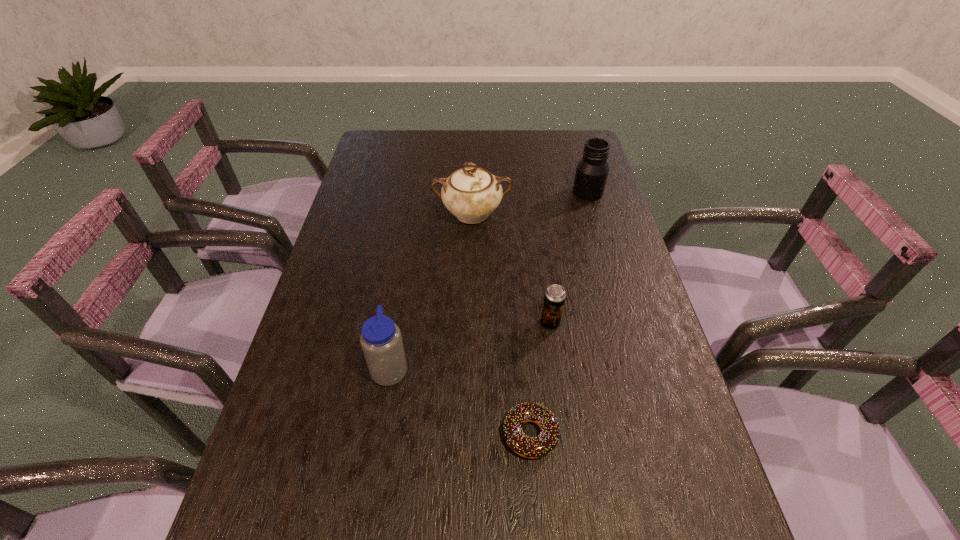
This screenshot has width=960, height=540. In order to click on unoccupied position between the water bottle and the nearest object in this screenshot , I will do `click(461, 401)`.

At what (x,y) coordinates should I click in order to perform the action: click on free space between the beer can and the jar. Please return your answer as a coordinate pair (x, y). The image size is (960, 540). Looking at the image, I should click on (569, 258).

Image resolution: width=960 pixels, height=540 pixels. I want to click on unoccupied position between the fourth tallest object and the chinaware, so click(x=512, y=268).

The image size is (960, 540). In order to click on free space between the water bottle and the doughnut in this screenshot , I will do `click(461, 401)`.

The width and height of the screenshot is (960, 540). I want to click on vacant region between the chinaware and the doughnut, so click(501, 324).

Locate an element on the screen. The height and width of the screenshot is (540, 960). vacant space in between the chinaware and the second nearest object is located at coordinates (431, 291).

Identify the location of vacant space that is in between the jar and the chinaware. (530, 203).

At what (x,y) coordinates should I click in order to perform the action: click on vacant area between the third nearest object and the rightmost object. Please return your answer as a coordinate pair (x, y). The width and height of the screenshot is (960, 540). Looking at the image, I should click on (569, 258).

Identify the location of the closest object relative to the chinaware. (592, 170).

Identify which object is the fourth nearest to the nearest object. Please provide its 2D coordinates. Your answer should be formatted as a tuple, i.e. [(x, y)], where the tuple contains the x and y coordinates of a point satisfying the conditions above.

[(592, 170)]